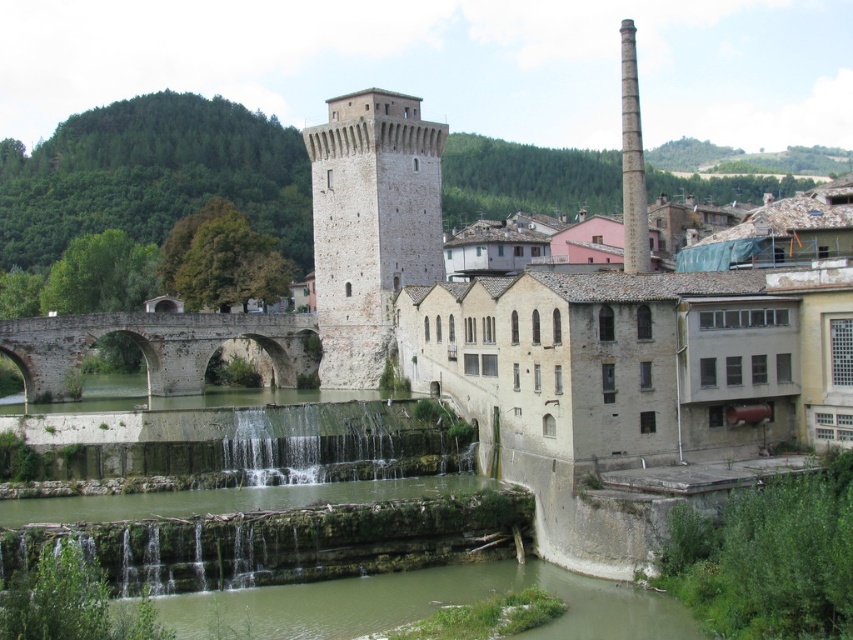
Can you confirm if smooth gray chimney at upper center is shorter than brown stone bridge at lower left?

No, smooth gray chimney at upper center is not shorter than brown stone bridge at lower left.

Is smooth gray chimney at upper center above brown stone bridge at lower left?

Yes.

Does point (392, 321) come farther from viewer compared to point (62, 378)?

Yes.

Image resolution: width=853 pixels, height=640 pixels. What are the coordinates of `smooth gray chimney at upper center` in the screenshot? It's located at (370, 225).

The width and height of the screenshot is (853, 640). What are the coordinates of `smooth gray chimney at upper center` in the screenshot? It's located at (370, 225).

Is smooth gray chimney at upper center below gray stone chimney at upper right?

Indeed, smooth gray chimney at upper center is positioned under gray stone chimney at upper right.

Who is more forward, (430, 250) or (640, 246)?

Point (640, 246)

You are a GUI agent. You are given a task and a screenshot of the screen. Output one action in this format:
    pyautogui.click(x=<x>, y=<y>)
    Task: Click on the smooth gray chimney at upper center
    
    Given the screenshot: What is the action you would take?
    pyautogui.click(x=370, y=225)

Looking at this image, which of these two, brown stone bridge at lower left or gray stone chimney at upper right, stands taller?

Standing taller between the two is gray stone chimney at upper right.

Does brown stone bridge at lower left have a lesser height compared to gray stone chimney at upper right?

Yes, brown stone bridge at lower left is shorter than gray stone chimney at upper right.

At what (x,y) coordinates should I click in order to perform the action: click on brown stone bridge at lower left. Please return your answer as a coordinate pair (x, y). The height and width of the screenshot is (640, 853). Looking at the image, I should click on (152, 346).